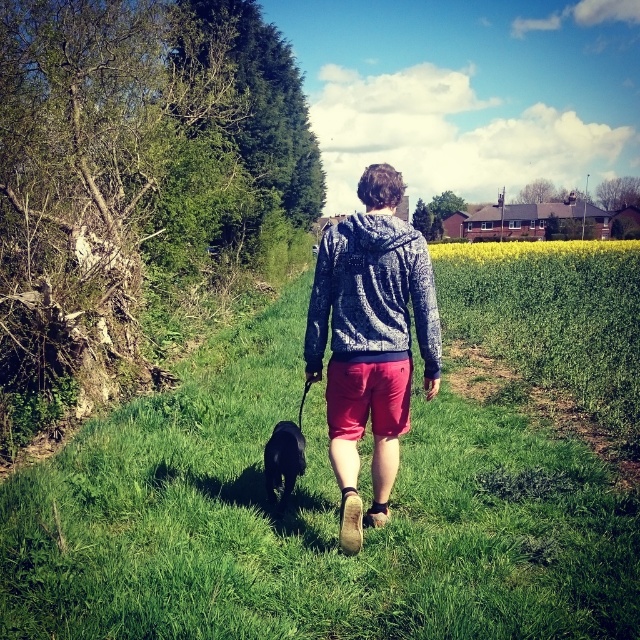
You are a drone operator trying to capture a photo of the speckled fleece hoodie at center and the black fur at center. What is the minimum distance you need to maintain between the two subjects to ensure they are both in focus?

The minimum distance you need to maintain between the speckled fleece hoodie at center and the black fur at center is 28.13 inches to ensure both are in focus.

You are a fashion designer observing the scene and notice two hoodies labeled as the same style. However, the speckled hoodie at center is taller than the speckled fleece hoodie at center. What is the difference between these two hoodies in terms of their height?

The speckled hoodie at center is taller than the speckled fleece hoodie at center.